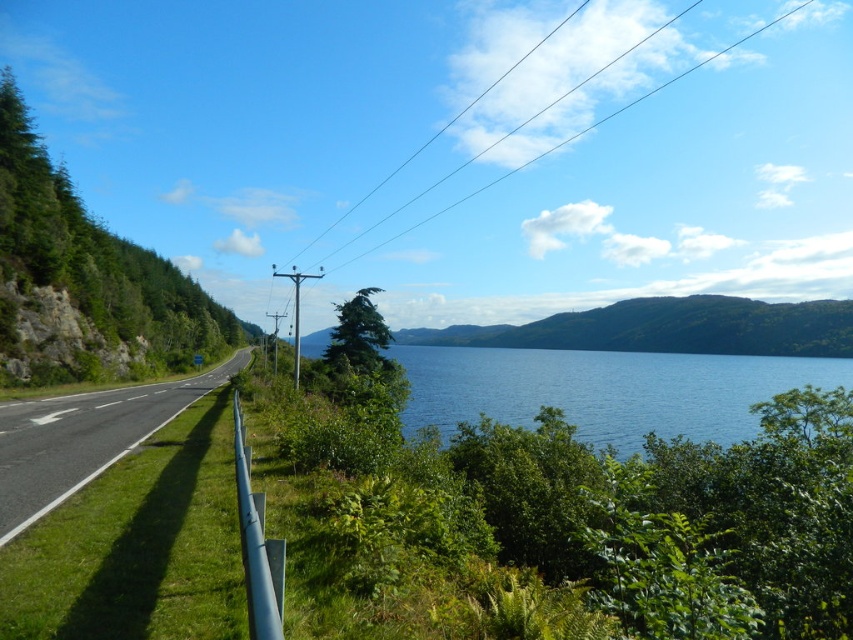
Can you confirm if blue water at center is wider than black wire at upper center?

Incorrect, blue water at center's width does not surpass black wire at upper center's.

Image resolution: width=853 pixels, height=640 pixels. Find the location of `blue water at center`. blue water at center is located at coordinates (605, 388).

Can you confirm if black asphalt highway at left is shorter than black wire at upper center?

Yes, black asphalt highway at left is shorter than black wire at upper center.

Is point (189, 404) more distant than point (581, 4)?

No, (189, 404) is in front of (581, 4).

What do you see at coordinates (83, 438) in the screenshot?
I see `black asphalt highway at left` at bounding box center [83, 438].

The image size is (853, 640). I want to click on black asphalt highway at left, so click(x=83, y=438).

Who is shorter, blue water at center or black asphalt highway at left?

black asphalt highway at left is shorter.

Where is `blue water at center`? Image resolution: width=853 pixels, height=640 pixels. blue water at center is located at coordinates (605, 388).

I want to click on blue water at center, so pyautogui.click(x=605, y=388).